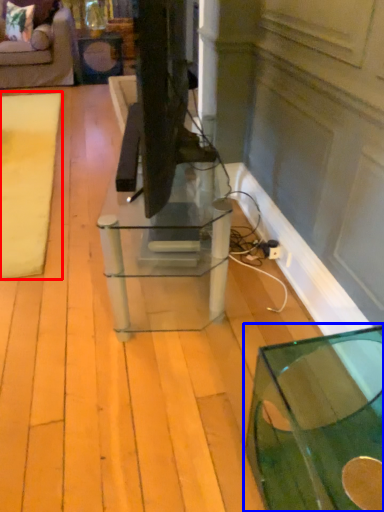
Question: Among these objects, which one is nearest to the camera, mat (highlighted by a red box) or table (highlighted by a blue box)?

Choices:
 (A) mat
 (B) table

Answer: (B)